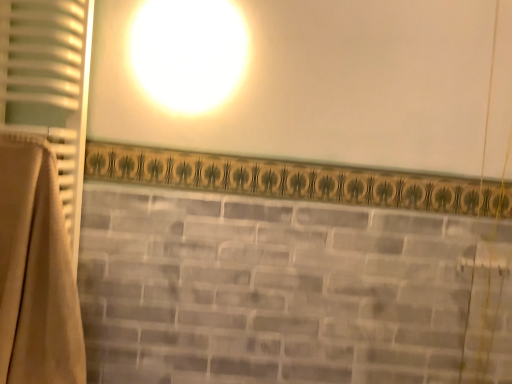
Question: From a real-world perspective, is beige fabric curtain at left, the 2th curtain when ordered from bottom to top, below beige fabric curtain at left, which is the first curtain from bottom to top?

Choices:
 (A) yes
 (B) no

Answer: (B)

Question: Is beige fabric curtain at left, the 2th curtain when ordered from bottom to top, at the right side of beige fabric curtain at left, which is the first curtain from bottom to top?

Choices:
 (A) yes
 (B) no

Answer: (B)

Question: Would you say beige fabric curtain at left, the 2th curtain when ordered from bottom to top, contains beige fabric curtain at left, which is the first curtain from bottom to top?

Choices:
 (A) yes
 (B) no

Answer: (B)

Question: Can you confirm if beige fabric curtain at left, the 2th curtain when ordered from bottom to top, is shorter than beige fabric curtain at left, which appears as the 2th curtain when viewed from the top?

Choices:
 (A) yes
 (B) no

Answer: (A)

Question: From the image's perspective, would you say beige fabric curtain at left, which appears as the first curtain when viewed from the top, is shown under beige fabric curtain at left, which appears as the 2th curtain when viewed from the top?

Choices:
 (A) no
 (B) yes

Answer: (A)

Question: Considering the relative positions of beige fabric curtain at left, which appears as the first curtain when viewed from the top, and beige fabric curtain at left, which appears as the 2th curtain when viewed from the top, in the image provided, is beige fabric curtain at left, which appears as the first curtain when viewed from the top, in front of beige fabric curtain at left, which appears as the 2th curtain when viewed from the top,?

Choices:
 (A) no
 (B) yes

Answer: (A)

Question: Does beige fabric curtain at left, which is the first curtain from bottom to top, have a smaller size compared to beige fabric curtain at left, the 2th curtain when ordered from bottom to top?

Choices:
 (A) no
 (B) yes

Answer: (A)

Question: Is beige fabric curtain at left, which appears as the 2th curtain when viewed from the top, positioned behind beige fabric curtain at left, the 2th curtain when ordered from bottom to top?

Choices:
 (A) yes
 (B) no

Answer: (B)

Question: Is beige fabric curtain at left, which appears as the 2th curtain when viewed from the top, wider than beige fabric curtain at left, which appears as the first curtain when viewed from the top?

Choices:
 (A) yes
 (B) no

Answer: (A)

Question: Is beige fabric curtain at left, which is the first curtain from bottom to top, facing towards beige fabric curtain at left, the 2th curtain when ordered from bottom to top?

Choices:
 (A) yes
 (B) no

Answer: (B)

Question: Does beige fabric curtain at left, which is the first curtain from bottom to top, lie in front of beige fabric curtain at left, which appears as the first curtain when viewed from the top?

Choices:
 (A) no
 (B) yes

Answer: (B)

Question: Considering the positions of beige fabric curtain at left, which is the first curtain from bottom to top, and beige fabric curtain at left, which appears as the first curtain when viewed from the top, in the image, is beige fabric curtain at left, which is the first curtain from bottom to top, taller or shorter than beige fabric curtain at left, which appears as the first curtain when viewed from the top,?

Choices:
 (A) short
 (B) tall

Answer: (B)